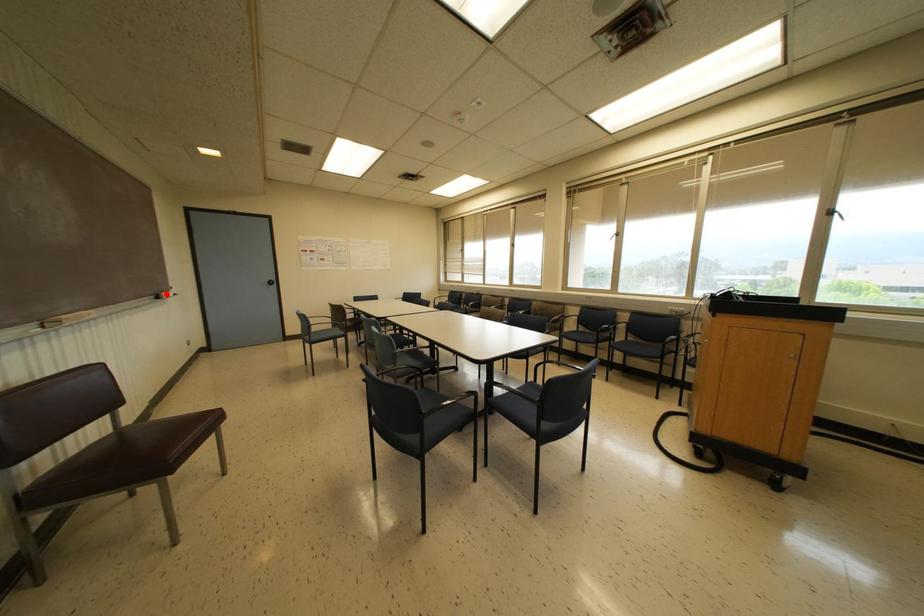
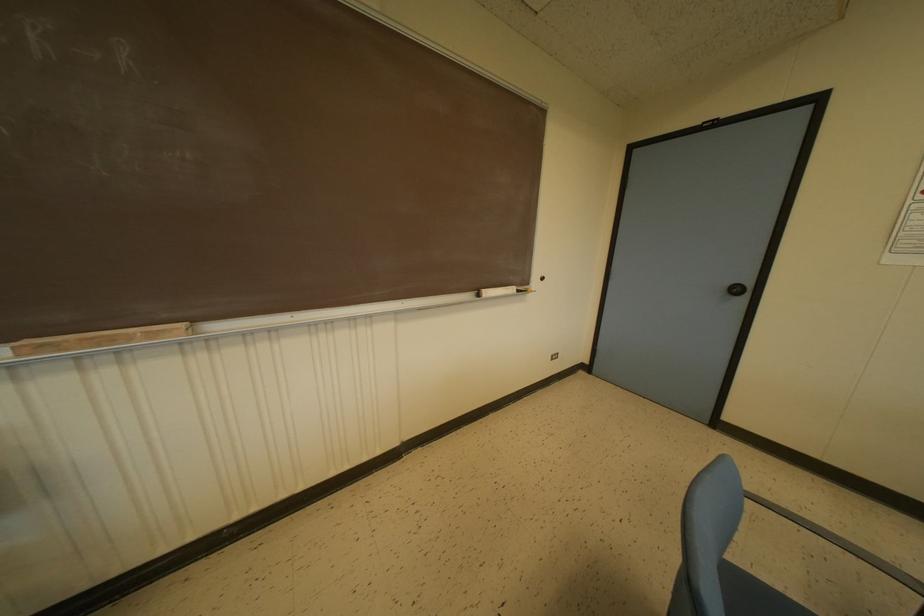
Where in the second image is the point corresponding to the highlighted location from the first image?

(487, 292)